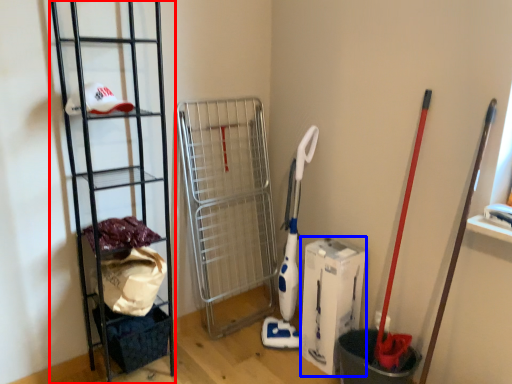
Question: Which point is closer to the camera, ladder (highlighted by a red box) or box (highlighted by a blue box)?

Choices:
 (A) ladder
 (B) box

Answer: (A)